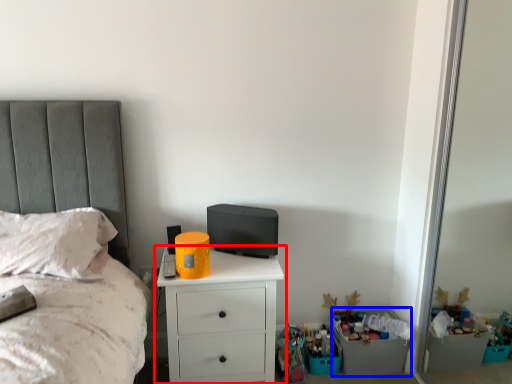
Question: Which object is closer to the camera taking this photo, chest of drawers (highlighted by a red box) or crate (highlighted by a blue box)?

Choices:
 (A) chest of drawers
 (B) crate

Answer: (A)